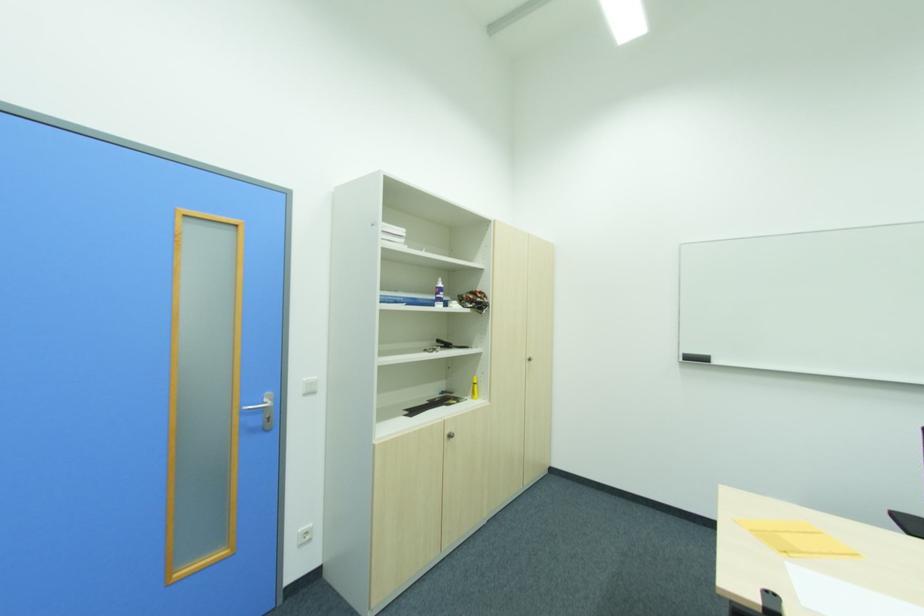
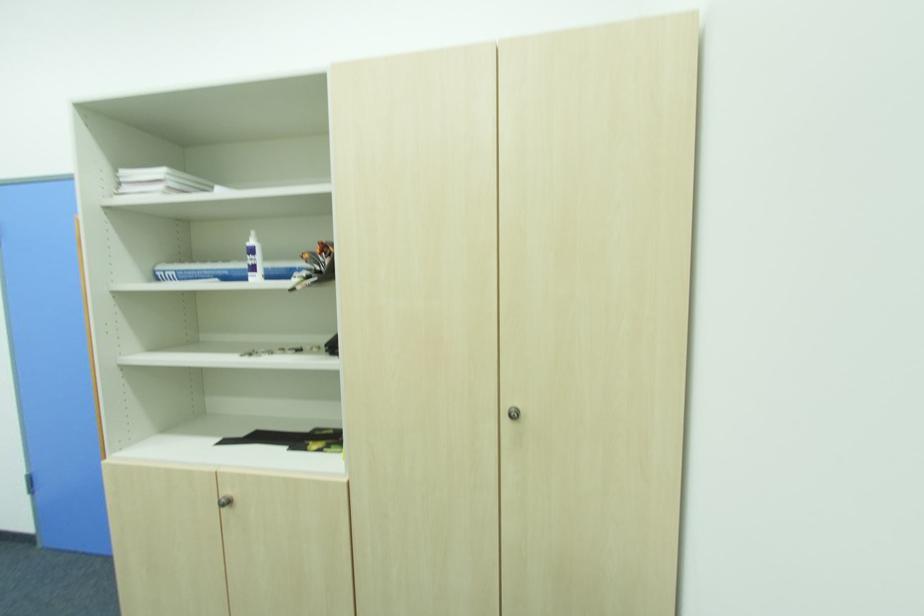
Locate, in the second image, the point that corresponds to pixel 444 285 in the first image.

(254, 243)